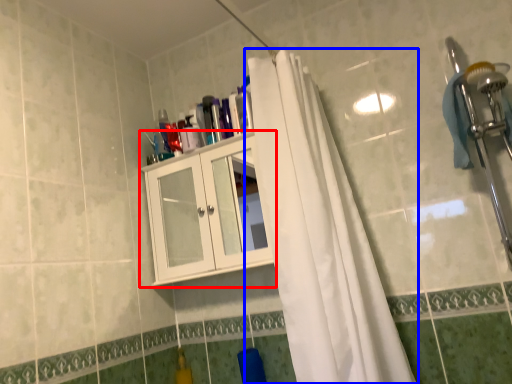
Question: Among these objects, which one is farthest to the camera, cabinetry (highlighted by a red box) or curtain (highlighted by a blue box)?

Choices:
 (A) cabinetry
 (B) curtain

Answer: (A)